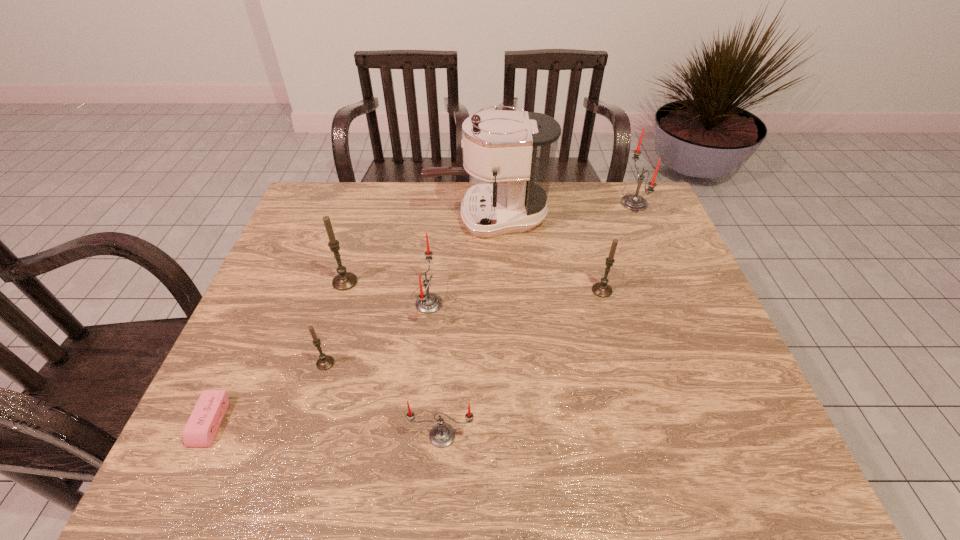
Find the location of a particular element. This screenshot has height=540, width=960. object that is at the right edge is located at coordinates (632, 202).

The image size is (960, 540). I want to click on object that is positioned at the near left corner, so click(x=201, y=428).

The width and height of the screenshot is (960, 540). I want to click on object present at the far right corner, so click(x=632, y=202).

Find the location of a particular element. vacant space at the far edge of the desktop is located at coordinates (547, 216).

I want to click on vacant area at the near edge, so click(x=324, y=454).

At what (x,y) coordinates should I click in order to perform the action: click on vacant space at the left edge. Please return your answer as a coordinate pair (x, y). Looking at the image, I should click on (243, 399).

In the image, there is a desktop. Where is `vacant area at the right edge`? The width and height of the screenshot is (960, 540). vacant area at the right edge is located at coordinates (619, 226).

The height and width of the screenshot is (540, 960). Find the location of `vacant region at the near left corner`. vacant region at the near left corner is located at coordinates (242, 462).

Where is `vacant point located between the smallest gray candle and the tallest object`? vacant point located between the smallest gray candle and the tallest object is located at coordinates (406, 291).

Identify the location of vacant space that's between the second candle from right to left and the biggest gray candle. (473, 286).